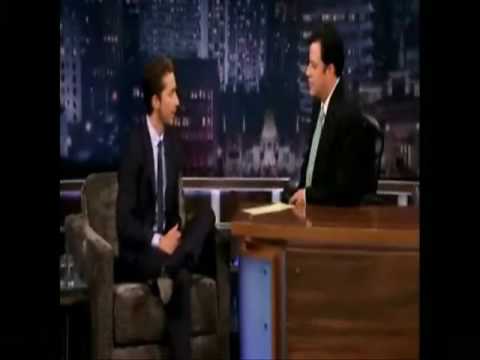
You are a GUI agent. You are given a task and a screenshot of the screen. Output one action in this format:
    pyautogui.click(x=<x>, y=<y>)
    Task: Click on the water glass
    
    Given the screenshot: What is the action you would take?
    pyautogui.click(x=66, y=276)